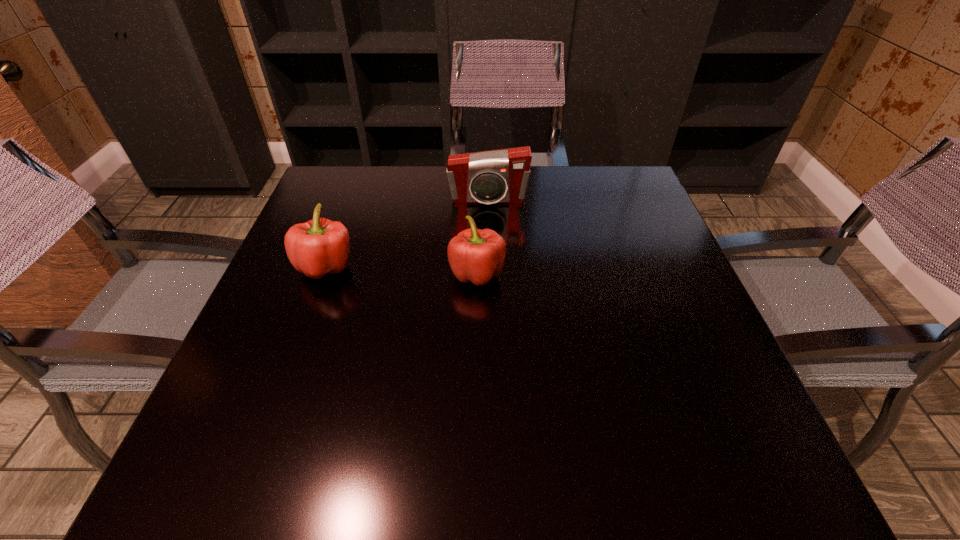
At what (x,y) coordinates should I click in order to perform the action: click on vacant space at the left edge of the desktop. Please return your answer as a coordinate pair (x, y). Looking at the image, I should click on (264, 433).

The height and width of the screenshot is (540, 960). What are the coordinates of `vacant space at the right edge` in the screenshot? It's located at (639, 304).

The width and height of the screenshot is (960, 540). In order to click on blank space at the near left corner of the desktop in this screenshot , I will do tap(186, 460).

The width and height of the screenshot is (960, 540). In the image, there is a desktop. Find the location of `vacant area at the far right corner`. vacant area at the far right corner is located at coordinates (591, 190).

This screenshot has height=540, width=960. Identify the location of vacant space that's between the camera and the left bell pepper. (407, 233).

Where is `unoccupied area between the camera and the leftmost object`? This screenshot has width=960, height=540. unoccupied area between the camera and the leftmost object is located at coordinates (407, 233).

Where is `vacant space that is in between the right bell pepper and the left bell pepper`? The height and width of the screenshot is (540, 960). vacant space that is in between the right bell pepper and the left bell pepper is located at coordinates (401, 269).

Identify the location of empty location between the left bell pepper and the farthest object. The height and width of the screenshot is (540, 960). (407, 233).

Where is `free point between the leftmost object and the right bell pepper`? The image size is (960, 540). free point between the leftmost object and the right bell pepper is located at coordinates (401, 269).

Locate an element on the screen. This screenshot has height=540, width=960. vacant space in between the camera and the leftmost object is located at coordinates (407, 233).